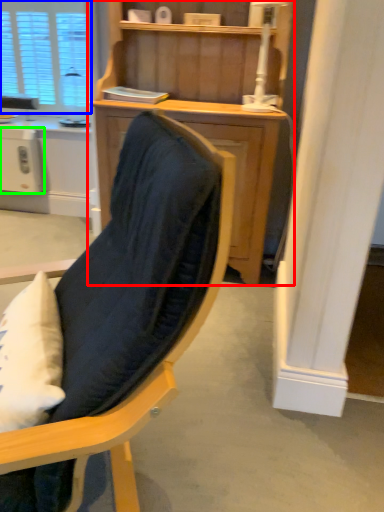
Question: Which is farther away from cupboard (highlighted by a red box)? window (highlighted by a blue box) or appliance (highlighted by a green box)?

Choices:
 (A) window
 (B) appliance

Answer: (A)